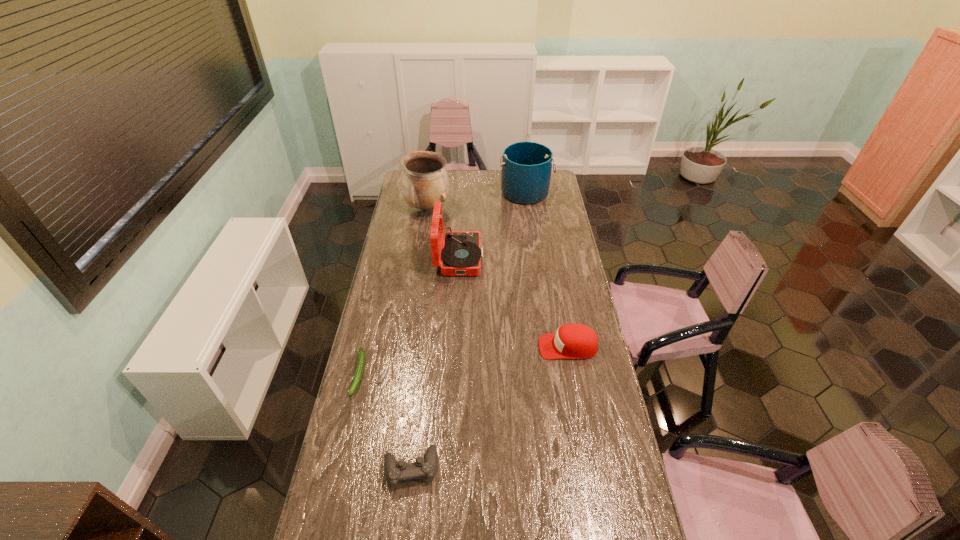
At what (x,y) coordinates should I click in order to perform the action: click on free spot between the bucket and the third shortest object. Please return your answer as a coordinate pair (x, y). Image resolution: width=960 pixels, height=540 pixels. Looking at the image, I should click on (546, 270).

I want to click on free space between the control and the baseball cap, so click(490, 407).

You are a GUI agent. You are given a task and a screenshot of the screen. Output one action in this format:
    pyautogui.click(x=<x>, y=<y>)
    Task: Click on the free space between the urn and the phonograph_record
    
    Given the screenshot: What is the action you would take?
    pyautogui.click(x=444, y=233)

This screenshot has height=540, width=960. I want to click on vacant point located between the phonograph_record and the control, so click(435, 363).

I want to click on free area in between the baseball cap and the zucchini, so click(464, 360).

Identify which object is located as the fifth nearest to the leftmost object. Please provide its 2D coordinates. Your answer should be formatted as a tuple, i.e. [(x, y)], where the tuple contains the x and y coordinates of a point satisfying the conditions above.

[(526, 166)]

Identify the location of object identified as the third closest to the fourth tallest object. (361, 354).

The width and height of the screenshot is (960, 540). What are the coordinates of `free space that satisfies the following two spatial constraints: 1. on the front-facing side of the phonograph_record; 2. on the front-facing side of the zucchini` in the screenshot? It's located at (453, 373).

The image size is (960, 540). Find the location of `vacant area in the image that satisfies the following two spatial constraints: 1. on the back side of the urn; 2. on the left side of the bucket`. vacant area in the image that satisfies the following two spatial constraints: 1. on the back side of the urn; 2. on the left side of the bucket is located at coordinates (430, 193).

Identify the location of vacant point that satisfies the following two spatial constraints: 1. on the front-facing side of the baseball cap; 2. on the front side of the control. The image size is (960, 540). (590, 468).